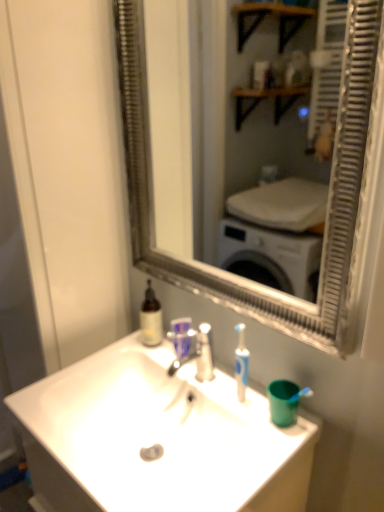
Image resolution: width=384 pixels, height=512 pixels. What are the coordinates of `vacant region under silver metallic mirror at center (from a real-world perspective)` in the screenshot? It's located at (232, 372).